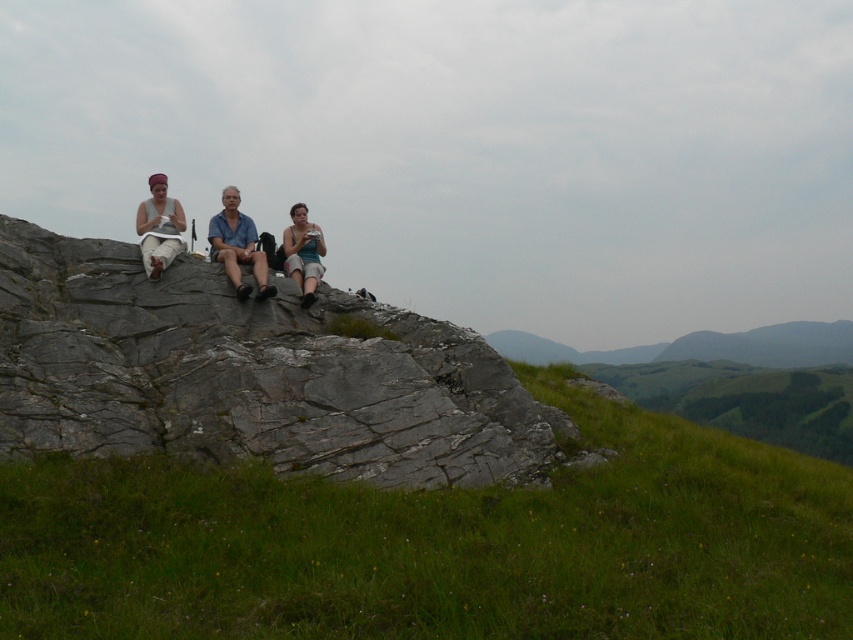
Does matte gray rock at center have a greater height compared to blue denim shirt at center?

Incorrect, matte gray rock at center's height is not larger of blue denim shirt at center's.

Which is more to the left, matte gray rock at center or blue denim shirt at center?

blue denim shirt at center is more to the left.

Does point (256, 259) come behind point (264, 280)?

Yes, it is behind point (264, 280).

The width and height of the screenshot is (853, 640). I want to click on matte gray rock at center, so click(238, 246).

Measure the distance between point (227, 214) and camera.

They are 35.91 feet apart.

The image size is (853, 640). Identify the location of matte gray rock at center. (238, 246).

Where is `matte gray rock at center`? matte gray rock at center is located at coordinates (238, 246).

Can you confirm if blue denim shirt at center is wider than matte blue tank top at center?

Yes.

Which of these two, blue denim shirt at center or matte blue tank top at center, stands taller?

Standing taller between the two is matte blue tank top at center.

Measure the distance between blue denim shirt at center and camera.

blue denim shirt at center is 9.24 meters from camera.

You are a GUI agent. You are given a task and a screenshot of the screen. Output one action in this format:
    pyautogui.click(x=<x>, y=<y>)
    Task: Click on the blue denim shirt at center
    This screenshot has width=853, height=640.
    Given the screenshot: What is the action you would take?
    click(236, 246)